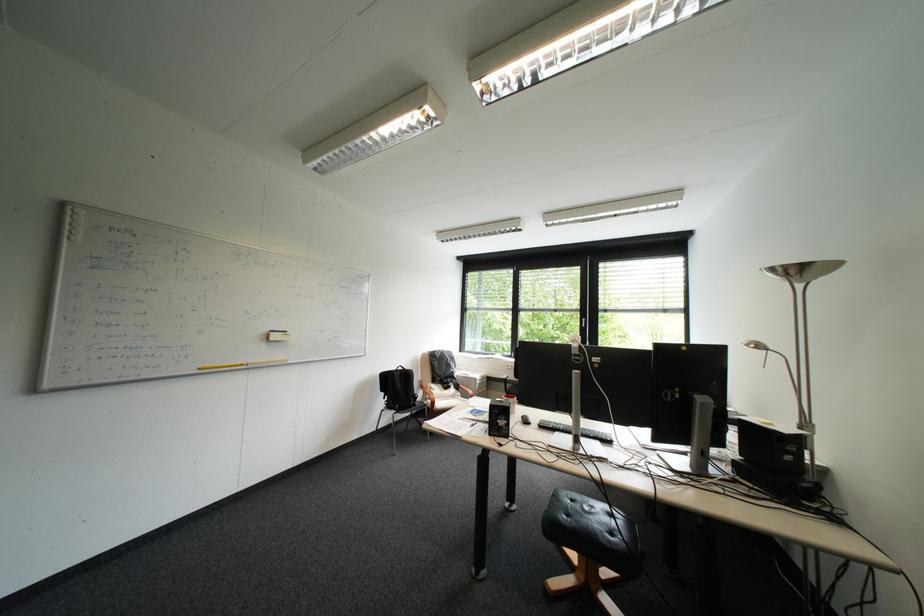
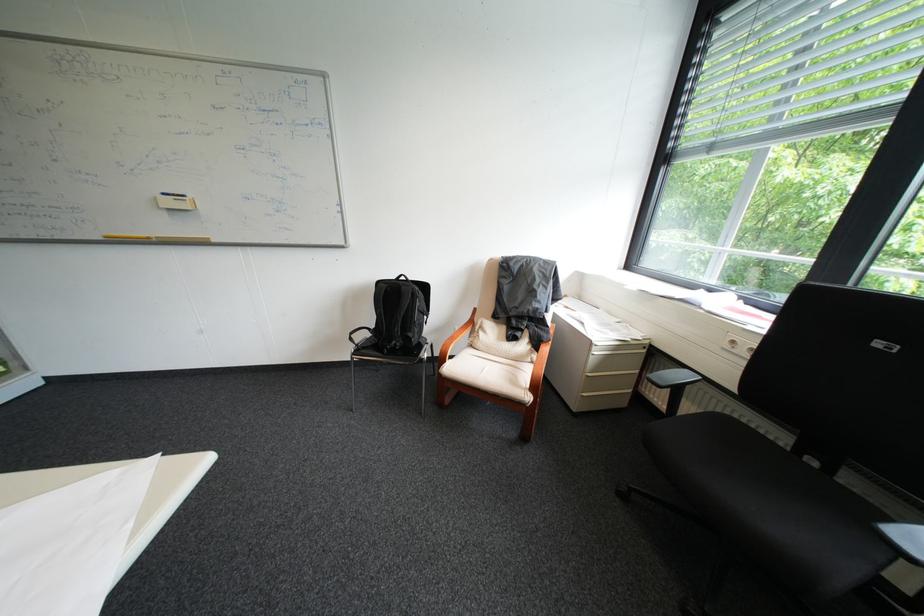
In the second image, find the point that corresponds to point 419,371 in the first image.

(415, 288)